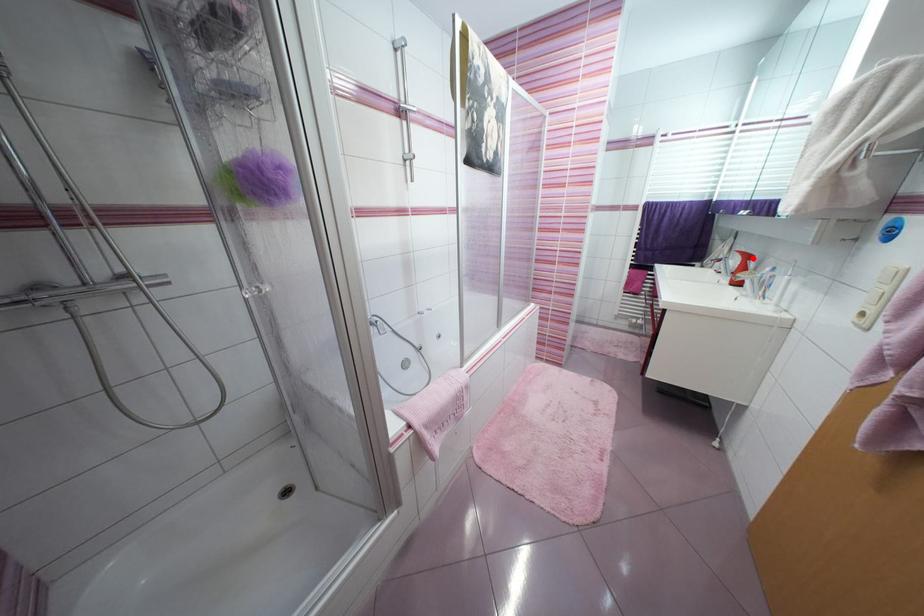
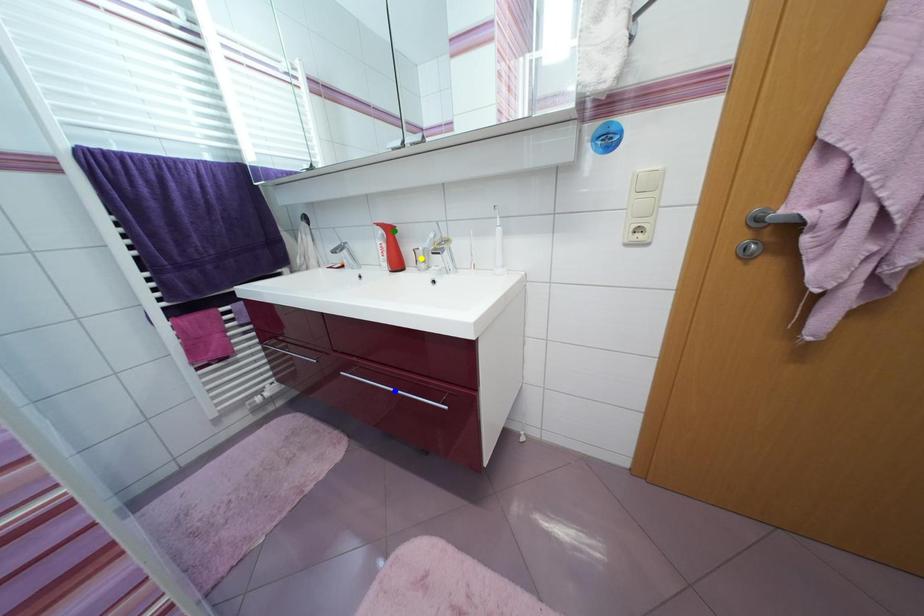
Question: I am providing you with two images of the same scene from different viewpoints. A red point is marked on the first image. You are given multiple points on the second image. Which point in image 2 is actually the same real-world point as the red point in image 1?

Choices:
 (A) blue point
 (B) green point
 (C) yellow point

Answer: (B)